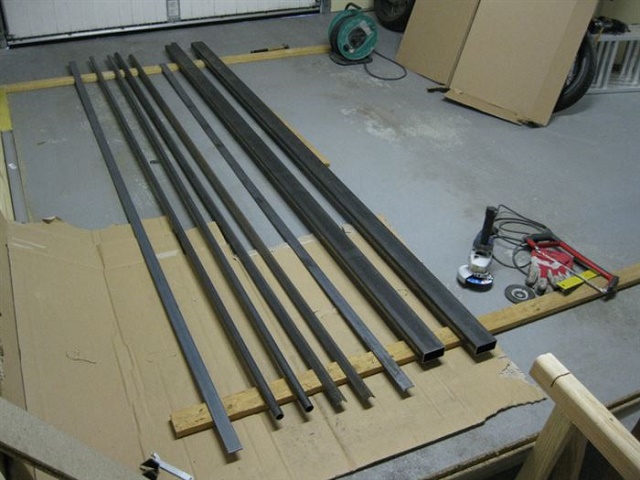
At what (x,y) coordinates should I click in order to perform the action: click on wood on floor. Please return your answer as a coordinate pair (x, y). This screenshot has height=480, width=640. Looking at the image, I should click on (497, 319), (260, 57).